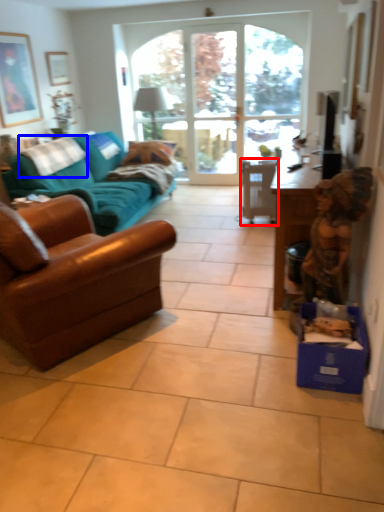
Question: Which object appears closest to the camera in this image, chair (highlighted by a red box) or pillow (highlighted by a blue box)?

Choices:
 (A) chair
 (B) pillow

Answer: (B)